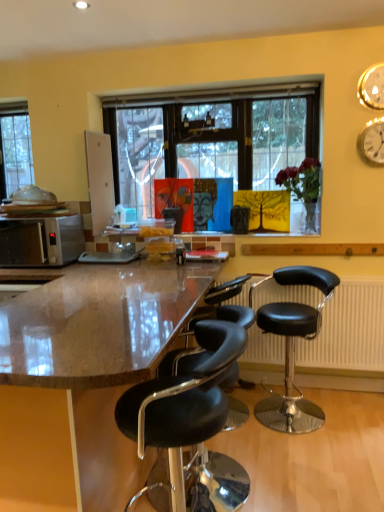
The height and width of the screenshot is (512, 384). I want to click on vacant region below translucent glass vase at upper center (from a real-world perspective), so click(295, 233).